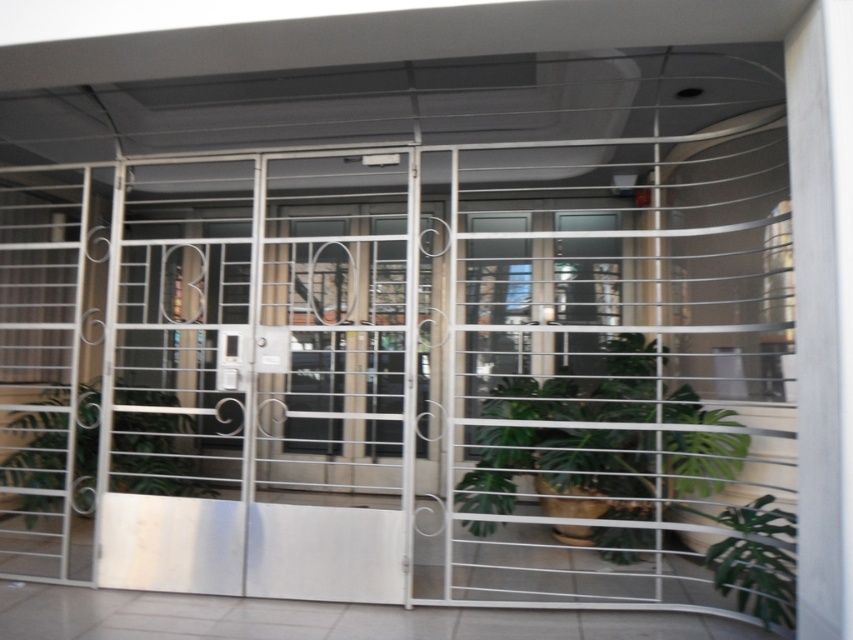
Is point (161, 400) positioned behind point (792, 573)?

Yes, it is behind point (792, 573).

Is green leafy plant at lower left smaller than green leafy plant at lower right?

Actually, green leafy plant at lower left might be larger than green leafy plant at lower right.

Which is behind, point (134, 474) or point (788, 560)?

Positioned behind is point (134, 474).

Find the location of `green leafy plant at lower left`. green leafy plant at lower left is located at coordinates (154, 454).

Based on the photo, which is more to the left, green leafy plant at center or green leafy plant at lower left?

From the viewer's perspective, green leafy plant at lower left appears more on the left side.

Which is behind, point (556, 376) or point (119, 480)?

Point (556, 376)

Identify the location of green leafy plant at center. (599, 467).

Does green leafy plant at center appear over green leafy plant at lower right?

Yes, green leafy plant at center is above green leafy plant at lower right.

Who is more forward, [676,468] or [741,592]?

Point [741,592]

Does point (651, 515) come closer to viewer compared to point (770, 620)?

No.

The image size is (853, 640). I want to click on green leafy plant at center, so click(x=599, y=467).